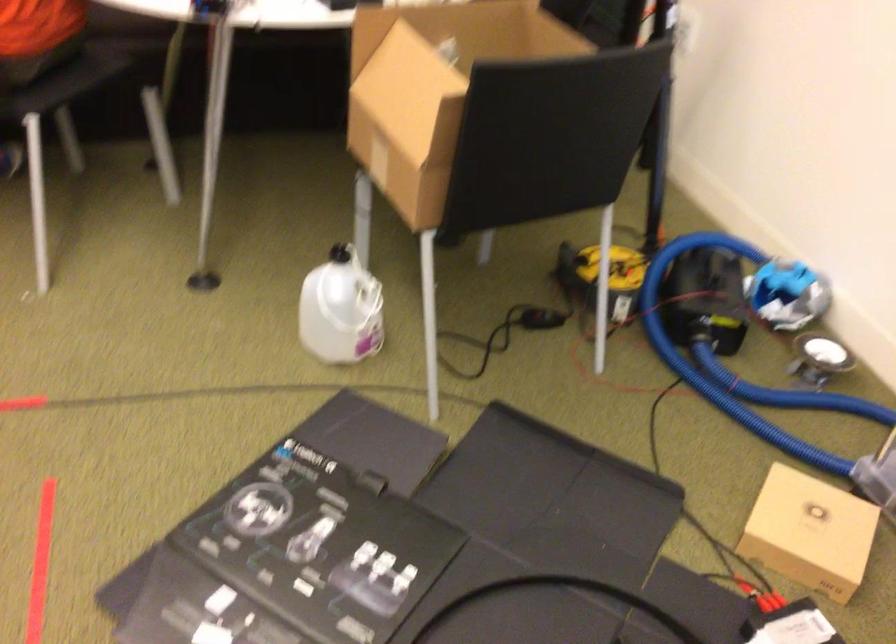
Which object does [810,532] point to?

It corresponds to the small cardboard box in the image.